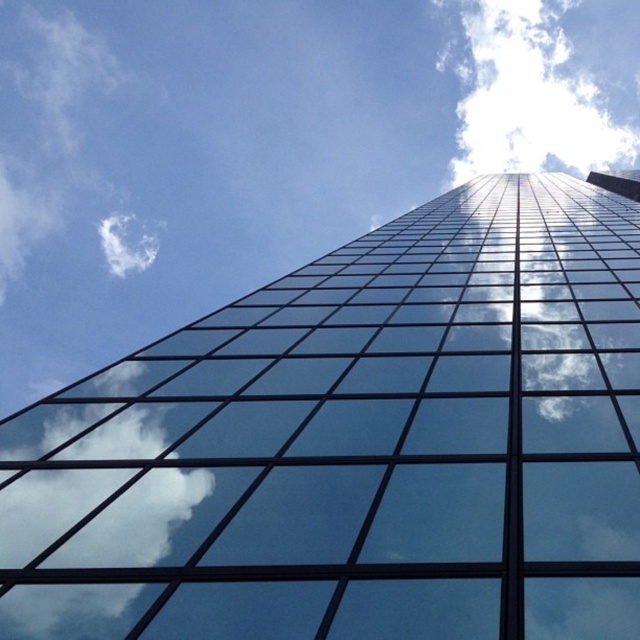
You are standing at the base of the skyscraper and want to take a photo of a specific point on the building. The point is located at coordinates point [116,429]. If your camera can focus on objects up to 35 feet away, will you be able to capture that point clearly?

The distance of point [116,429] from viewer is 36.50 feet, which is beyond the camera focus range of 35 feet. Therefore, the camera cannot capture the point clearly.

You are an architect analyzing the skyscraper. From your perspective, does the transparent glass building at center appear larger or smaller than the white fluffy cloud at upper left?

The transparent glass building at center appears smaller than the white fluffy cloud at upper left because the description states that it has a smaller size compared to the cloud.

You are an architect analyzing the skyscraper in the image. You notice the transparent glass building at center and the white fluffy cloud at upper left. Which object appears taller in the image?

The transparent glass building at center has a lesser height compared to white fluffy cloud at upper left, so the white fluffy cloud at upper left appears taller in the image.